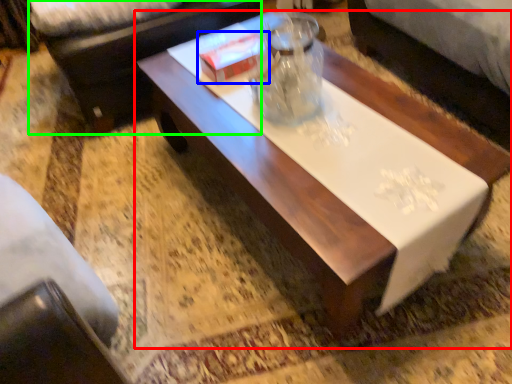
Question: Which object is the closest to the coffee table (highlighted by a red box)? Choose among these: box (highlighted by a blue box) or couch (highlighted by a green box).

Choices:
 (A) box
 (B) couch

Answer: (A)